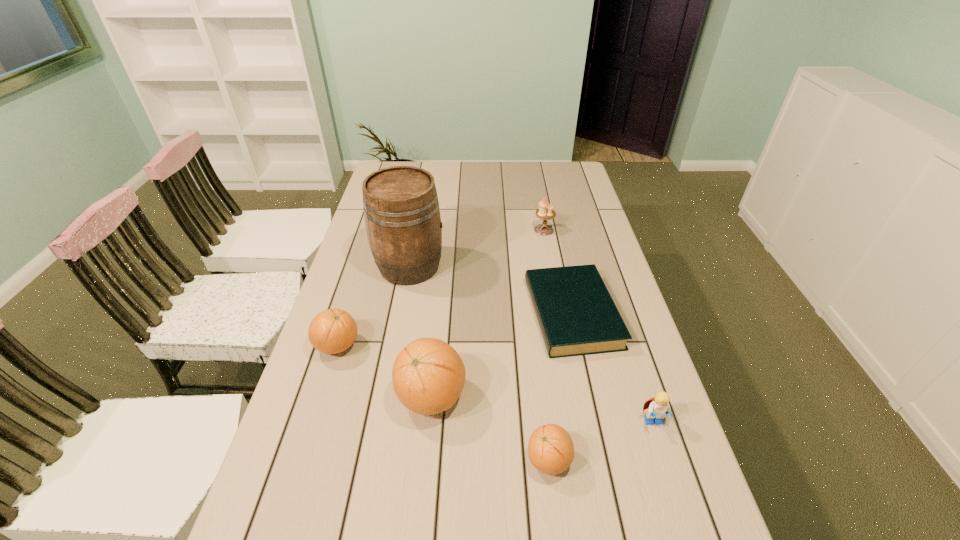
I want to click on book that is at the right edge, so click(576, 314).

The width and height of the screenshot is (960, 540). I want to click on Lego present at the right edge, so click(x=659, y=406).

Identify the location of free region at the far edge. (512, 163).

At what (x,y) coordinates should I click in order to perform the action: click on vacant space at the right edge of the desktop. Please return your answer as a coordinate pair (x, y). This screenshot has width=960, height=540. Looking at the image, I should click on (628, 355).

This screenshot has height=540, width=960. In the image, there is a desktop. What are the coordinates of `vacant space at the near left corner` in the screenshot? It's located at (333, 507).

Image resolution: width=960 pixels, height=540 pixels. In order to click on free point at the near right corner in this screenshot , I will do `click(690, 534)`.

You are a GUI agent. You are given a task and a screenshot of the screen. Output one action in this format:
    pyautogui.click(x=<x>, y=<y>)
    Task: Click on the free space between the farthest object and the second orange from right to left
    The width and height of the screenshot is (960, 540).
    Given the screenshot: What is the action you would take?
    pyautogui.click(x=488, y=313)

Where is `free space between the nearest object and the tallest orange`? The image size is (960, 540). free space between the nearest object and the tallest orange is located at coordinates (490, 428).

Identify the location of free space between the shortest orange and the Lego. (601, 441).

Where is `empty space between the tallest object and the farthest orange`? The image size is (960, 540). empty space between the tallest object and the farthest orange is located at coordinates (373, 306).